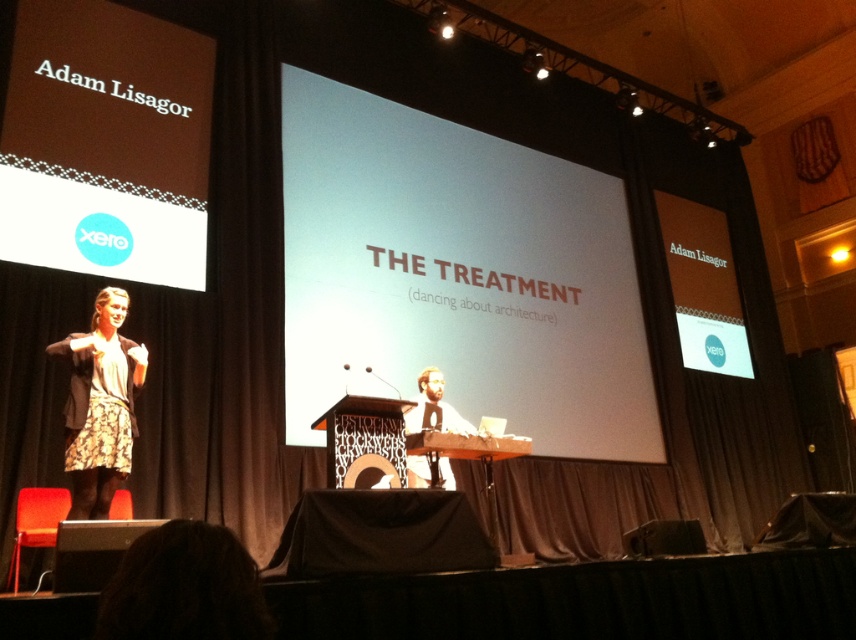
Based on the photo, measure the distance between point (87, 435) and camera.

They are 4.49 meters apart.

Does brown floral dress at left come in front of light brown wood podium at center?

Yes, it is in front of light brown wood podium at center.

Measure the distance between point (x=114, y=353) and camera.

4.77 meters

You are a GUI agent. You are given a task and a screenshot of the screen. Output one action in this format:
    pyautogui.click(x=<x>, y=<y>)
    Task: Click on the brown floral dress at left
    
    Given the screenshot: What is the action you would take?
    pyautogui.click(x=100, y=404)

Looking at this image, between white matte projection screen at center and light brown wood podium at center, which one is positioned higher?

white matte projection screen at center is higher up.

Is white matte projection screen at center wider than light brown wood podium at center?

Yes, white matte projection screen at center is wider than light brown wood podium at center.

What do you see at coordinates (456, 275) in the screenshot? I see `white matte projection screen at center` at bounding box center [456, 275].

The width and height of the screenshot is (856, 640). What are the coordinates of `white matte projection screen at center` in the screenshot? It's located at (456, 275).

Between white matte projection screen at center and brown floral dress at left, which one has less height?

brown floral dress at left

What do you see at coordinates (456, 275) in the screenshot? I see `white matte projection screen at center` at bounding box center [456, 275].

What do you see at coordinates (456, 275) in the screenshot?
I see `white matte projection screen at center` at bounding box center [456, 275].

At what (x,y) coordinates should I click in order to perform the action: click on white matte projection screen at center. Please return your answer as a coordinate pair (x, y). Image resolution: width=856 pixels, height=640 pixels. Looking at the image, I should click on (456, 275).